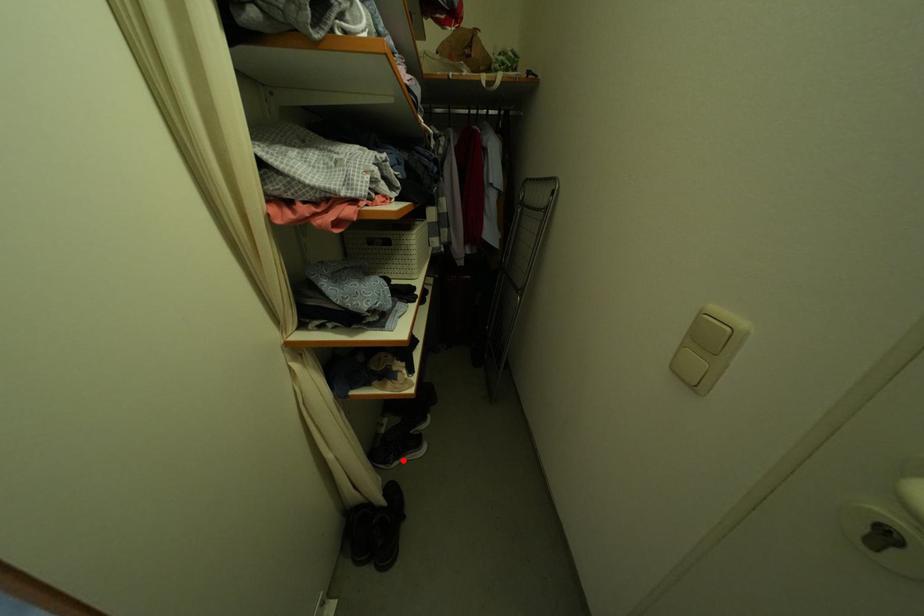
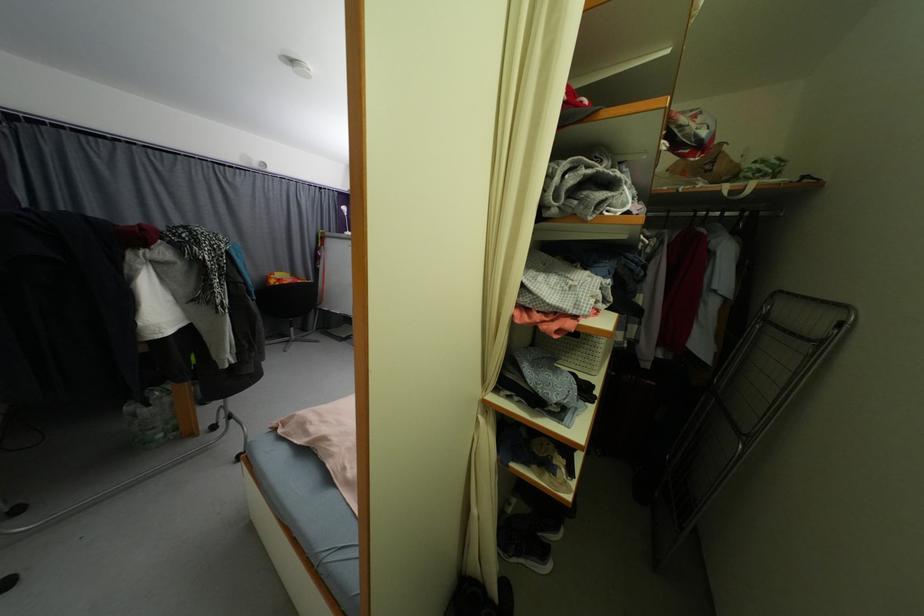
Question: I am providing you with two images of the same scene from different viewpoints. Given a red point in image1, look at the same physical point in image2. Is it:

Choices:
 (A) Closer to the viewpoint
 (B) Farther from the viewpoint

Answer: (B)